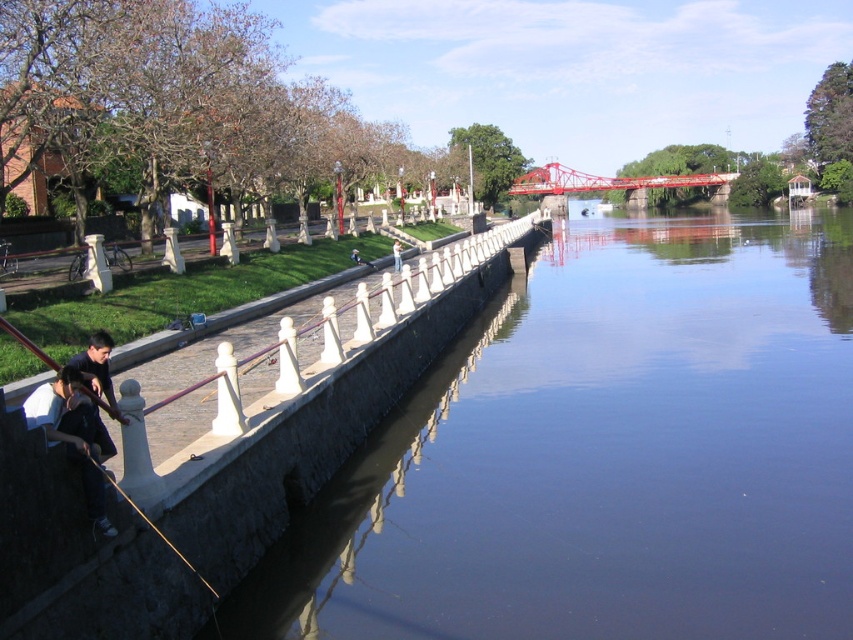
Is smooth white pole at lower left smaller than light brown wooden pole at center?

Yes, smooth white pole at lower left is smaller than light brown wooden pole at center.

Is smooth white pole at lower left in front of light brown wooden pole at center?

Yes.

Is point (107, 481) closer to camera compared to point (399, 260)?

Yes, it is.

This screenshot has height=640, width=853. Identify the location of smooth white pole at lower left. (148, 520).

Measure the distance between smooth concrete water at center and camera.

smooth concrete water at center is 22.74 feet from camera.

Is point (221, 616) positioned behind point (149, 525)?

Yes.

Identify the location of smooth concrete water at center. (604, 454).

Can you confirm if dark blue fabric at lower left is positioned above smooth white pole at lower left?

Yes.

Find the location of `dark blue fabric at lower left`. dark blue fabric at lower left is located at coordinates (73, 435).

Describe the element at coordinates (73, 435) in the screenshot. The image size is (853, 640). I see `dark blue fabric at lower left` at that location.

Find the location of a particular element. dark blue fabric at lower left is located at coordinates (73, 435).